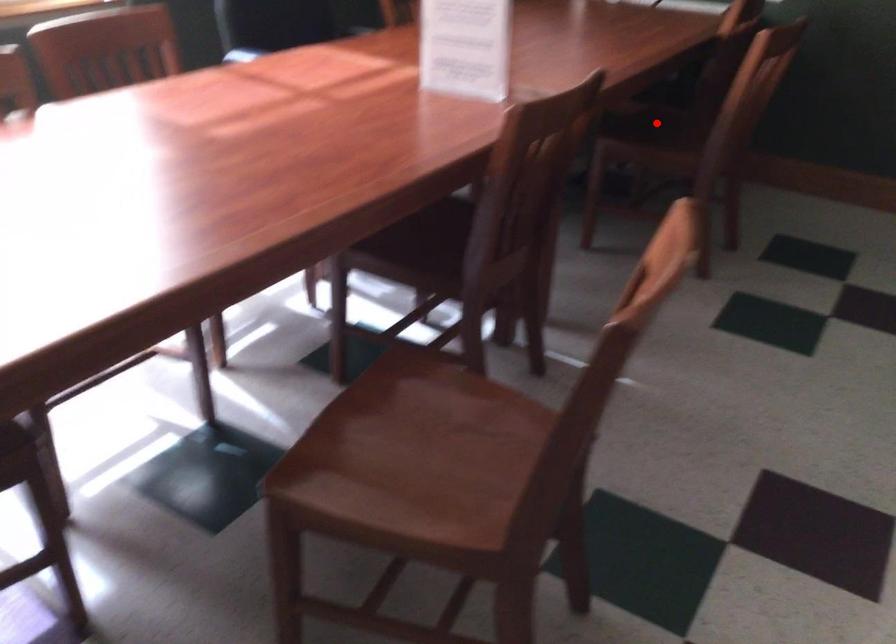
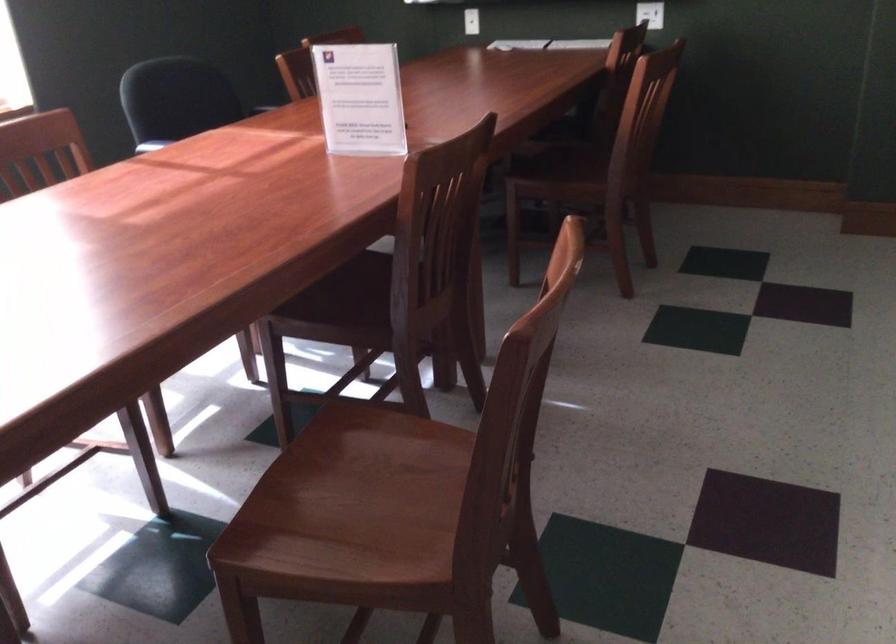
Locate, in the second image, the point that corresponds to the highlighted location in the first image.

(561, 158)